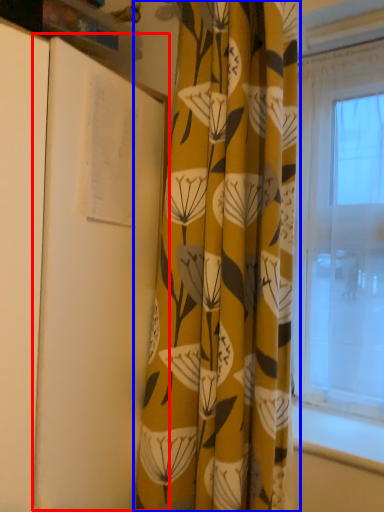
Question: Which point is further to the camera, notebook (highlighted by a red box) or curtain (highlighted by a blue box)?

Choices:
 (A) notebook
 (B) curtain

Answer: (B)